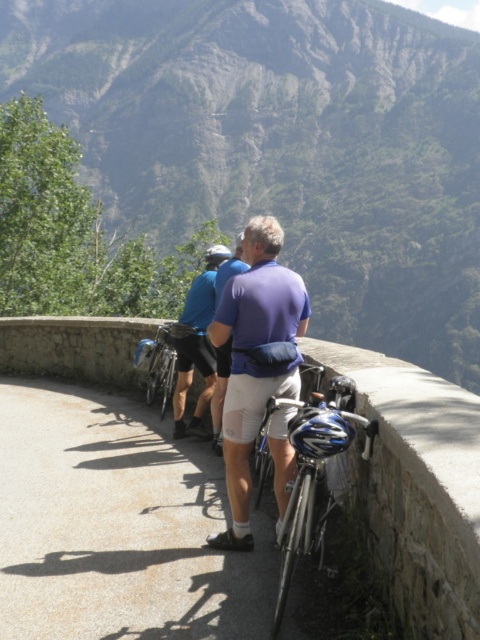
Please look at the image and locate the point at coordinates (319,432). Which object is this point located on?

The point at coordinates (319,432) is located on the blue matte bicycle helmet at center.

You are a photographer trying to capture a photo of the shiny metallic bicycle at lower right and the blue fabric shirt at center. Since you want both subjects to be clearly visible in the frame, which object should you focus on first to ensure proper focus?

The shiny metallic bicycle at lower right should be focused on first because it is shorter than the blue fabric shirt at center, so focusing on the closer object first will help ensure both are in focus.

You are a photographer positioned at the scene. You want to capture a photo where the shiny metallic bicycle at lower right is visible in the foreground and the blue fabric shirt at center is in the background. Is this possible given their positions?

Yes, the shiny metallic bicycle at lower right is below blue fabric shirt at center, so positioning the camera to focus on the bicycle while keeping the shirt in the background will achieve the desired composition.